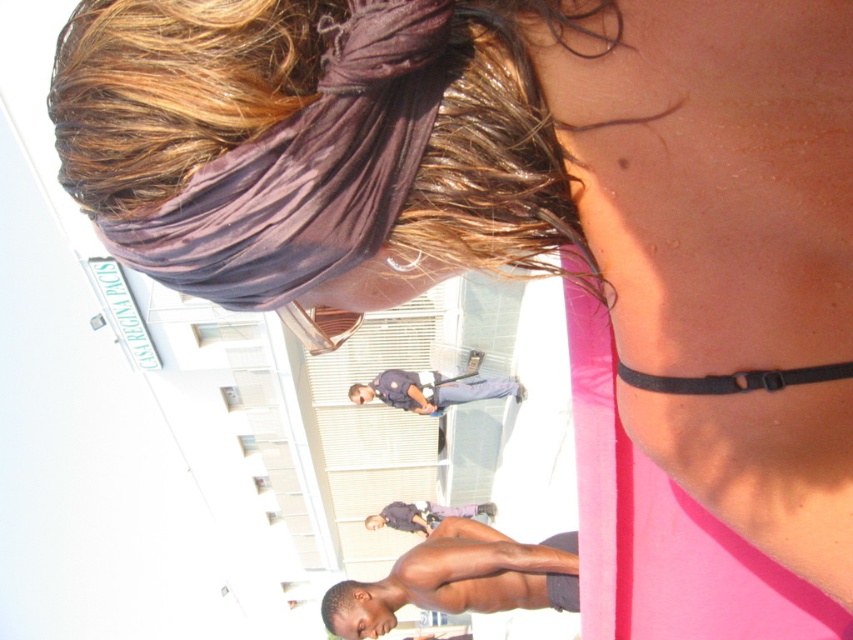
You are an artist trying to sketch the scene. You notice the purple satin headband at upper center and the brown skin man at lower center. Which object has a smaller width in the image?

The purple satin headband at upper center has a lesser width compared to the brown skin man at lower center.

You are a photographer trying to capture both the brown skin man at lower center and the dark purple shirt at center in a single frame. Considering their sizes, which one should you focus on to ensure both fit well in the photo?

Since the brown skin man at lower center is smaller than the dark purple shirt at center, you should focus on the dark purple shirt at center to ensure both fit well in the photo.